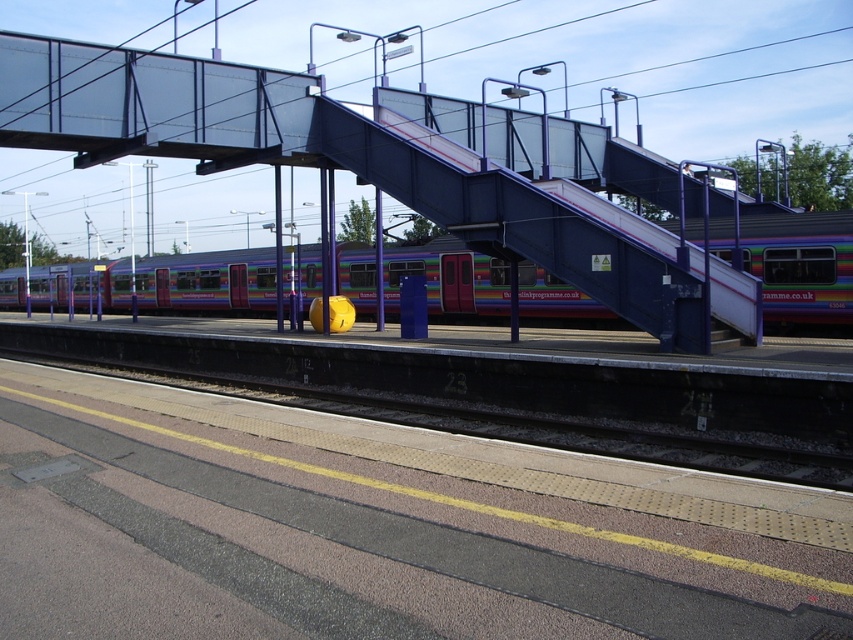
Measure the distance between metallic blue escalator at center and camera.

metallic blue escalator at center is 14.35 meters away from camera.

Can you confirm if metallic blue escalator at center is shorter than metallic purple train at center?

In fact, metallic blue escalator at center may be taller than metallic purple train at center.

Measure the distance between metallic blue escalator at center and camera.

metallic blue escalator at center is 14.35 meters away from camera.

You are a GUI agent. You are given a task and a screenshot of the screen. Output one action in this format:
    pyautogui.click(x=<x>, y=<y>)
    Task: Click on the metallic blue escalator at center
    This screenshot has height=640, width=853.
    Given the screenshot: What is the action you would take?
    pyautogui.click(x=544, y=227)